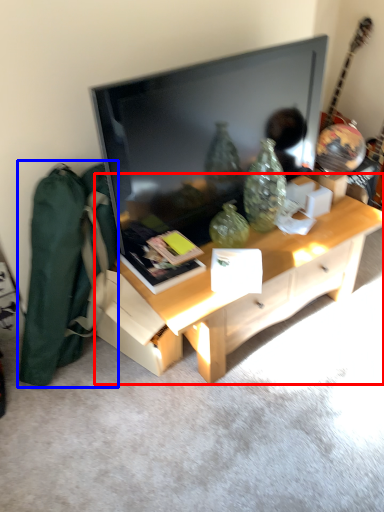
Question: Which point is further to the camera, desk (highlighted by a red box) or messenger bag (highlighted by a blue box)?

Choices:
 (A) desk
 (B) messenger bag

Answer: (A)